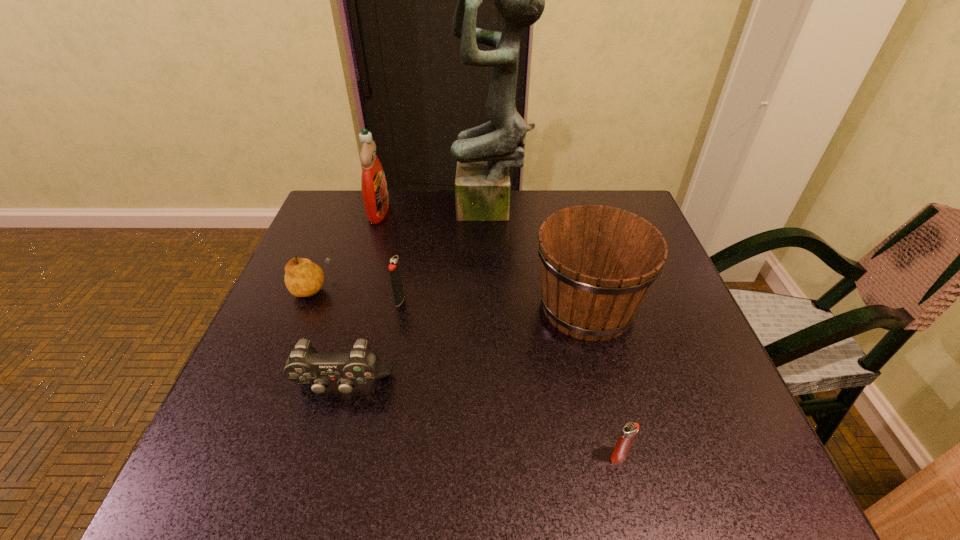
Where is `object at the near edge`? The width and height of the screenshot is (960, 540). object at the near edge is located at coordinates (629, 431).

Image resolution: width=960 pixels, height=540 pixels. Find the location of `detergent that is at the left edge`. detergent that is at the left edge is located at coordinates (375, 196).

The width and height of the screenshot is (960, 540). In order to click on control that is at the left edge in this screenshot , I will do [x=305, y=365].

Identify the location of pear situated at the left edge. click(x=303, y=278).

Where is `object that is positioned at the right edge`? The image size is (960, 540). object that is positioned at the right edge is located at coordinates (598, 263).

You are a GUI agent. You are given a task and a screenshot of the screen. Output one action in this format:
    pyautogui.click(x=<x>, y=<y>)
    Task: Click on the object situated at the far left corner
    Image resolution: width=960 pixels, height=540 pixels.
    Given the screenshot: What is the action you would take?
    pyautogui.click(x=375, y=196)

In the image, there is a desktop. Identify the location of free region at the far edge. (524, 221).

You are a GUI agent. You are given a task and a screenshot of the screen. Output one action in this format:
    pyautogui.click(x=<x>, y=<y>)
    Task: Click on the vacant space at the near edge of the desktop
    The height and width of the screenshot is (540, 960).
    Given the screenshot: What is the action you would take?
    pyautogui.click(x=518, y=468)

This screenshot has width=960, height=540. Find the location of `vacant space at the left edge of the desktop`. vacant space at the left edge of the desktop is located at coordinates (304, 435).

The image size is (960, 540). Find the location of `vacant space at the right edge`. vacant space at the right edge is located at coordinates (708, 429).